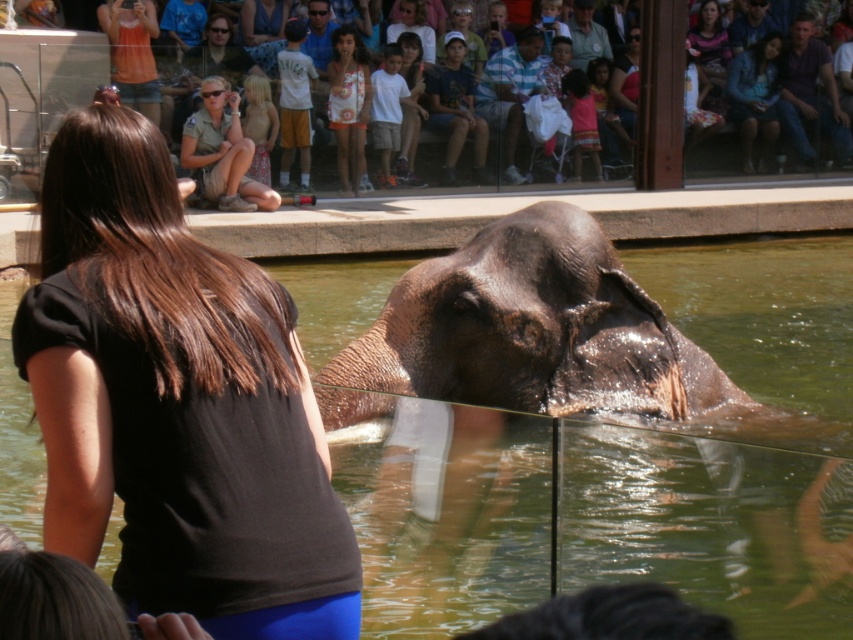
Between green liquid water at elephant front and black fabric shirt at center, which one is positioned lower?

black fabric shirt at center is below.

Does green liquid water at elephant front appear under black fabric shirt at center?

Incorrect, green liquid water at elephant front is not positioned below black fabric shirt at center.

The image size is (853, 640). Find the location of `green liquid water at elephant front`. green liquid water at elephant front is located at coordinates (732, 449).

You are a GUI agent. You are given a task and a screenshot of the screen. Output one action in this format:
    pyautogui.click(x=<x>, y=<y>)
    Task: Click on the green liquid water at elephant front
    The image size is (853, 640).
    Given the screenshot: What is the action you would take?
    pyautogui.click(x=732, y=449)

Who is more distant from viewer, (786, 257) or (590, 413)?

The point (786, 257) is behind.

Is green liquid water at elephant front above dark brown wrinkled skin elephant at center?

Yes, green liquid water at elephant front is above dark brown wrinkled skin elephant at center.

Between point (39, 465) and point (543, 381), which one is positioned behind?

Point (39, 465)

Locate an element on the screen. The width and height of the screenshot is (853, 640). green liquid water at elephant front is located at coordinates (732, 449).

Can you confirm if black fabric shirt at center is bigger than dark brown wrinkled skin elephant at center?

Incorrect, black fabric shirt at center is not larger than dark brown wrinkled skin elephant at center.

Does point (120, 196) lie behind point (697, 388)?

No, (120, 196) is closer to viewer.

The height and width of the screenshot is (640, 853). What do you see at coordinates (177, 403) in the screenshot? I see `black fabric shirt at center` at bounding box center [177, 403].

You are a GUI agent. You are given a task and a screenshot of the screen. Output one action in this format:
    pyautogui.click(x=<x>, y=<y>)
    Task: Click on the black fabric shirt at center
    
    Given the screenshot: What is the action you would take?
    pyautogui.click(x=177, y=403)